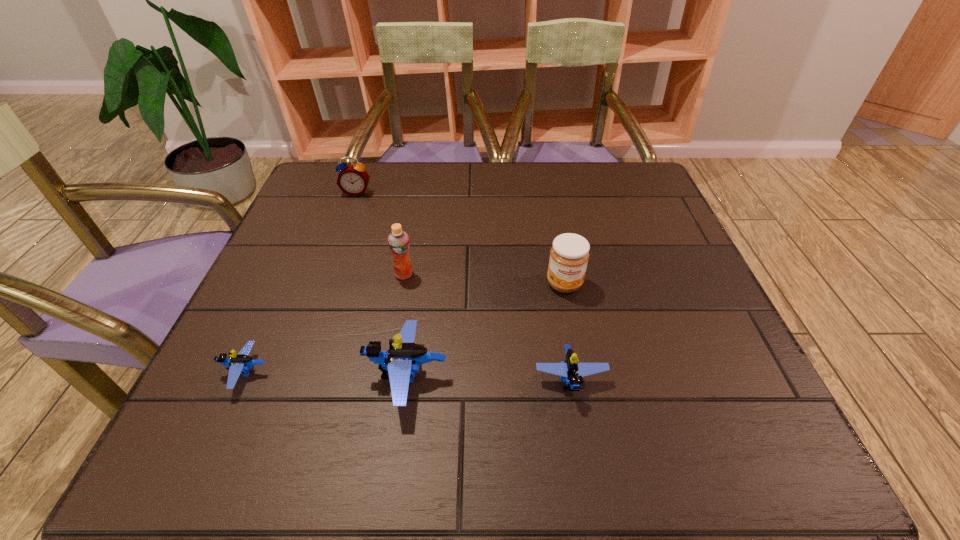
Find the location of a particular element. This screenshot has width=960, height=540. vacant space that satisfies the following two spatial constraints: 1. on the front side of the tallest object; 2. on the front-facing side of the leftmost object is located at coordinates (386, 373).

At what (x,y) coordinates should I click in order to perform the action: click on free space that satisfies the following two spatial constraints: 1. on the front side of the orange juice; 2. on the front-facing side of the shortest Lego. Please return your answer as a coordinate pair (x, y). Image resolution: width=960 pixels, height=540 pixels. Looking at the image, I should click on (386, 373).